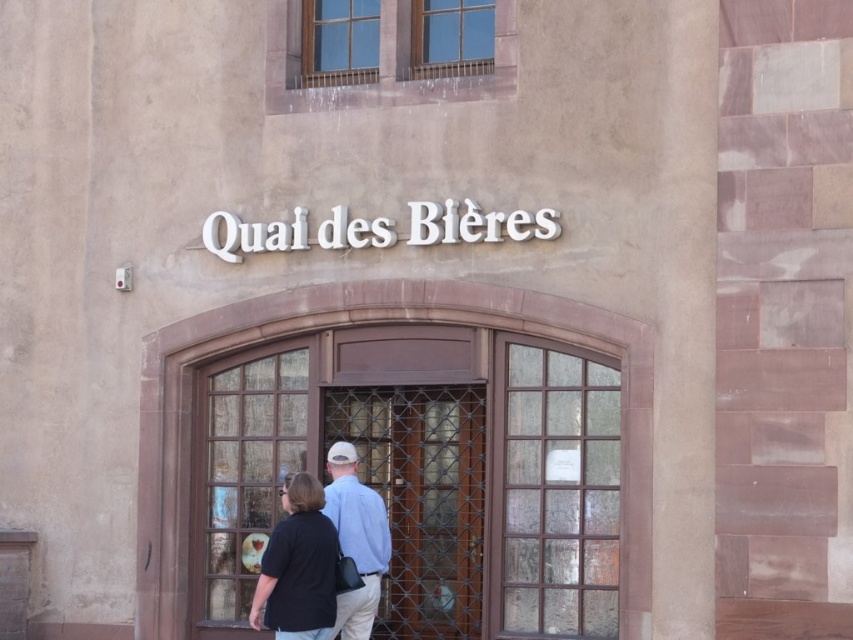
Is point (543, 301) in front of point (438, 573)?

Yes, it is in front of point (438, 573).

Image resolution: width=853 pixels, height=640 pixels. What do you see at coordinates (364, 323) in the screenshot?
I see `wooden door at center` at bounding box center [364, 323].

Which is in front, point (206, 355) or point (376, 483)?

Point (206, 355) is more forward.

Locate an element on the screen. wooden door at center is located at coordinates (364, 323).

Is brown wooden door at center bigger than dark blue shirt at center?

Correct, brown wooden door at center is larger in size than dark blue shirt at center.

From the picture: Between brown wooden door at center and dark blue shirt at center, which one appears on the right side from the viewer's perspective?

brown wooden door at center is more to the right.

Is point (445, 637) positioned after point (352, 636)?

Yes, point (445, 637) is farther from viewer.

Locate an element on the screen. The image size is (853, 640). brown wooden door at center is located at coordinates (422, 499).

Measure the distance between point (x=445, y=544) and camera.

Point (x=445, y=544) is 15.20 meters away from camera.

Is point (399, 534) positioned behind point (351, 541)?

Yes, point (399, 534) is behind point (351, 541).

Consider the image. Who is more forward, [383,628] or [335,506]?

Point [335,506] is more forward.

You are a GUI agent. You are given a task and a screenshot of the screen. Output one action in this format:
    pyautogui.click(x=<x>, y=<y>)
    Task: Click on the brown wooden door at center
    
    Given the screenshot: What is the action you would take?
    pyautogui.click(x=422, y=499)